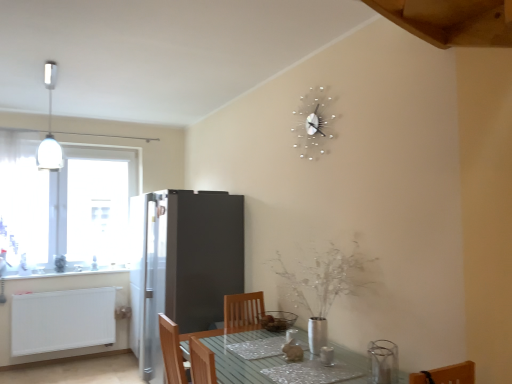
Question: Is white glossy counter top at left further to the viewer compared to wooden at upper right?

Choices:
 (A) yes
 (B) no

Answer: (A)

Question: Does white glossy counter top at left turn towards wooden at upper right?

Choices:
 (A) yes
 (B) no

Answer: (B)

Question: Is white glossy counter top at left turned away from wooden at upper right?

Choices:
 (A) yes
 (B) no

Answer: (B)

Question: From the image's perspective, is white glossy counter top at left on top of wooden at upper right?

Choices:
 (A) yes
 (B) no

Answer: (B)

Question: Is white glossy counter top at left directly adjacent to wooden at upper right?

Choices:
 (A) yes
 (B) no

Answer: (B)

Question: Considering the positions of white glossy light fixture at upper left and silver metallic clock at upper center in the image, is white glossy light fixture at upper left wider or thinner than silver metallic clock at upper center?

Choices:
 (A) wide
 (B) thin

Answer: (A)

Question: In the image, is white glossy light fixture at upper left on the left side or the right side of silver metallic clock at upper center?

Choices:
 (A) left
 (B) right

Answer: (A)

Question: Considering the positions of point (53, 152) and point (311, 144), is point (53, 152) closer or farther from the camera than point (311, 144)?

Choices:
 (A) closer
 (B) farther

Answer: (B)

Question: From a real-world perspective, relative to silver metallic clock at upper center, is white glossy light fixture at upper left vertically above or below?

Choices:
 (A) below
 (B) above

Answer: (B)

Question: Is point tap(36, 155) positioned closer to the camera than point tap(303, 291)?

Choices:
 (A) farther
 (B) closer

Answer: (A)

Question: Is white glossy light fixture at upper left inside or outside of silver metallic vase at center?

Choices:
 (A) inside
 (B) outside

Answer: (B)

Question: Is white glossy light fixture at upper left to the left or to the right of silver metallic vase at center in the image?

Choices:
 (A) left
 (B) right

Answer: (A)

Question: Is white glossy light fixture at upper left in front of or behind silver metallic vase at center in the image?

Choices:
 (A) behind
 (B) front

Answer: (A)

Question: Looking at their shapes, would you say satin silver refrigerator at center-left is wider or thinner than white glossy light fixture at upper left?

Choices:
 (A) thin
 (B) wide

Answer: (B)

Question: From a real-world perspective, relative to white glossy light fixture at upper left, is satin silver refrigerator at center-left vertically above or below?

Choices:
 (A) above
 (B) below

Answer: (B)